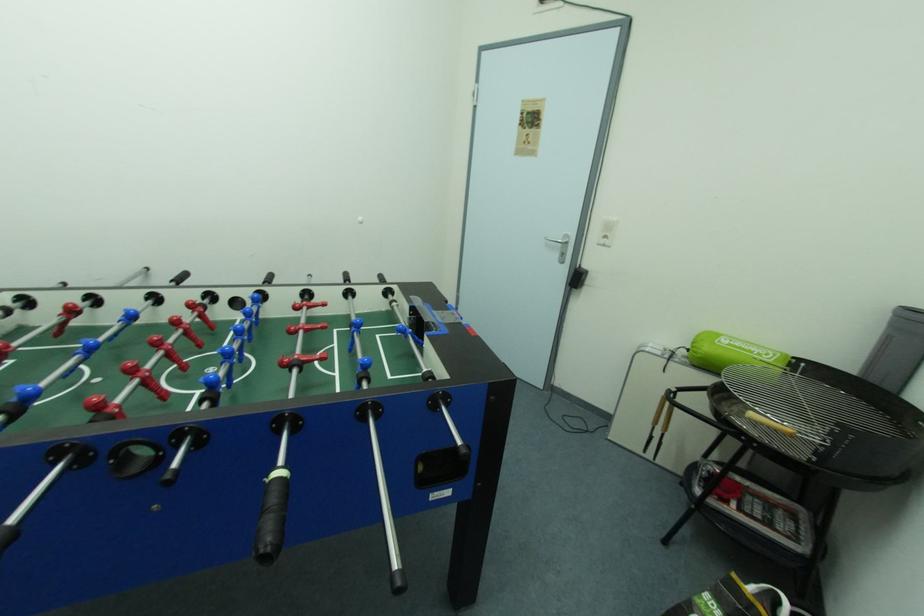
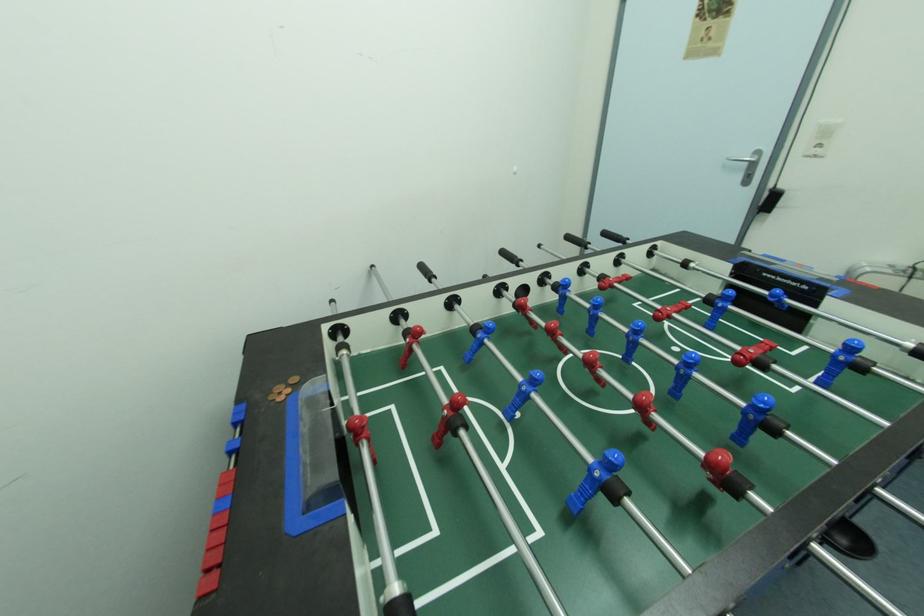
Question: In a continuous first-person perspective shot, in which direction is the camera moving?

Choices:
 (A) Left
 (B) Right
 (C) Forward
 (D) Backward

Answer: (A)